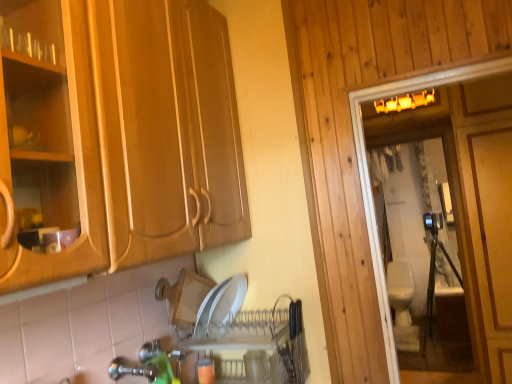
This screenshot has height=384, width=512. I want to click on beige ceramic toilet at right, so click(x=400, y=291).

Find the location of `white glossy toilet at right`. white glossy toilet at right is located at coordinates (474, 354).

This screenshot has height=384, width=512. Identify the location of beige ceramic toilet at right. (400, 291).

Which object is further away from the camera, beige ceramic toilet at right or white glossy toilet at right?

beige ceramic toilet at right is more distant.

This screenshot has width=512, height=384. Identify the location of screen door that is above the beige ceramic toilet at right (from the image's perspective). (474, 354).

From a real-world perspective, which object stands above the other?

white glossy toilet at right, from a real-world perspective.

Between point (135, 362) and point (472, 311), which one is positioned behind?

Positioned behind is point (472, 311).

Does green plastic faucet at lower center have a lesser width compared to white glossy toilet at right?

In fact, green plastic faucet at lower center might be wider than white glossy toilet at right.

From the image's perspective, is green plastic faucet at lower center positioned above or below white glossy toilet at right?

Clearly, from the image's perspective, green plastic faucet at lower center is below white glossy toilet at right.

Between green plastic faucet at lower center and white glossy toilet at right, which one appears on the left side from the viewer's perspective?

green plastic faucet at lower center.

Considering the sizes of green plastic faucet at lower center and beige ceramic toilet at right in the image, is green plastic faucet at lower center wider or thinner than beige ceramic toilet at right?

Clearly, green plastic faucet at lower center has less width compared to beige ceramic toilet at right.

Can you confirm if green plastic faucet at lower center is shorter than beige ceramic toilet at right?

Yes.

Is green plastic faucet at lower center positioned with its back to beige ceramic toilet at right?

No, green plastic faucet at lower center is not facing away from beige ceramic toilet at right.

Locate an element on the screen. The image size is (512, 384). toilet bowl that appears behind the green plastic faucet at lower center is located at coordinates (400, 291).

Is white glossy toilet at right positioned with its back to green plastic faucet at lower center?

No, white glossy toilet at right is not facing away from green plastic faucet at lower center.

Considering the relative sizes of white glossy toilet at right and green plastic faucet at lower center in the image provided, is white glossy toilet at right thinner than green plastic faucet at lower center?

Yes, white glossy toilet at right is thinner than green plastic faucet at lower center.

Is white glossy toilet at right in contact with green plastic faucet at lower center?

There is a gap between white glossy toilet at right and green plastic faucet at lower center.

Is point (479, 355) positioned after point (120, 368)?

Yes, point (479, 355) is farther from viewer.

Which is less distant, (396, 294) or (146, 369)?

The point (146, 369) is closer to the camera.

Which of these two, beige ceramic toilet at right or green plastic faucet at lower center, stands shorter?

green plastic faucet at lower center.

Considering the positions of objects beige ceramic toilet at right and green plastic faucet at lower center in the image provided, who is more to the right, beige ceramic toilet at right or green plastic faucet at lower center?

Positioned to the right is beige ceramic toilet at right.

Is beige ceramic toilet at right not inside green plastic faucet at lower center?

Absolutely, beige ceramic toilet at right is external to green plastic faucet at lower center.

Is white glossy toilet at right not within beige ceramic toilet at right?

Yes, white glossy toilet at right is located beyond the bounds of beige ceramic toilet at right.

Is white glossy toilet at right oriented away from beige ceramic toilet at right?

No, white glossy toilet at right is not facing the opposite direction of beige ceramic toilet at right.

Does point (477, 337) come farther from viewer compared to point (409, 270)?

No, it is in front of (409, 270).

Where is `toilet bowl that is below the white glossy toilet at right (from the image's perspective)`? toilet bowl that is below the white glossy toilet at right (from the image's perspective) is located at coordinates click(400, 291).

At what (x,y) coordinates should I click in order to perform the action: click on screen door on the right side of green plastic faucet at lower center. Please return your answer as a coordinate pair (x, y). The height and width of the screenshot is (384, 512). Looking at the image, I should click on (474, 354).

Which object lies further to the anchor point green plastic faucet at lower center, beige ceramic toilet at right or white glossy toilet at right?

beige ceramic toilet at right is further to green plastic faucet at lower center.

Which object lies nearer to the anchor point white glossy toilet at right, green plastic faucet at lower center or beige ceramic toilet at right?

beige ceramic toilet at right is positioned closer to the anchor white glossy toilet at right.

Looking at the image, which one is located further to beige ceramic toilet at right, green plastic faucet at lower center or white glossy toilet at right?

green plastic faucet at lower center is further to beige ceramic toilet at right.

When comparing their distances from beige ceramic toilet at right, does white glossy toilet at right or green plastic faucet at lower center seem further?

green plastic faucet at lower center.

Based on their spatial positions, is white glossy toilet at right or beige ceramic toilet at right further from green plastic faucet at lower center?

Among the two, beige ceramic toilet at right is located further to green plastic faucet at lower center.

Which object lies further to the anchor point white glossy toilet at right, beige ceramic toilet at right or green plastic faucet at lower center?

green plastic faucet at lower center is further to white glossy toilet at right.

This screenshot has height=384, width=512. Find the location of `screen door between green plastic faucet at lower center and beige ceramic toilet at right along the z-axis`. screen door between green plastic faucet at lower center and beige ceramic toilet at right along the z-axis is located at coordinates (x=474, y=354).